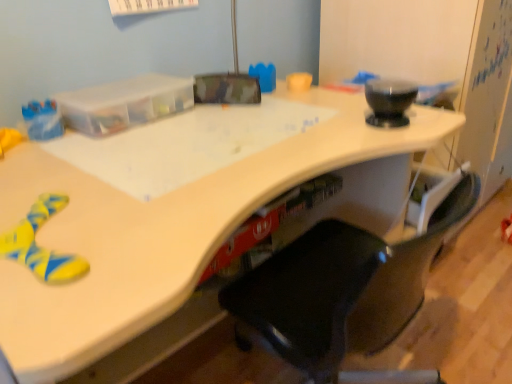
Question: Considering the relative positions of white glossy desk at lower left and rubberized red toy at lower right in the image provided, is white glossy desk at lower left to the right of rubberized red toy at lower right from the viewer's perspective?

Choices:
 (A) yes
 (B) no

Answer: (B)

Question: Considering the relative sizes of white glossy desk at lower left and rubberized red toy at lower right in the image provided, is white glossy desk at lower left smaller than rubberized red toy at lower right?

Choices:
 (A) yes
 (B) no

Answer: (B)

Question: Can you confirm if white glossy desk at lower left is positioned to the left of rubberized red toy at lower right?

Choices:
 (A) yes
 (B) no

Answer: (A)

Question: From a real-world perspective, is white glossy desk at lower left over rubberized red toy at lower right?

Choices:
 (A) no
 (B) yes

Answer: (A)

Question: Is white glossy desk at lower left positioned far away from rubberized red toy at lower right?

Choices:
 (A) no
 (B) yes

Answer: (B)

Question: Is white glossy desk at lower left oriented away from rubberized red toy at lower right?

Choices:
 (A) yes
 (B) no

Answer: (B)

Question: Is black plastic chair at center placed right next to white glossy desk at lower left?

Choices:
 (A) yes
 (B) no

Answer: (B)

Question: Does black plastic chair at center turn towards white glossy desk at lower left?

Choices:
 (A) yes
 (B) no

Answer: (B)

Question: Can you confirm if black plastic chair at center is taller than white glossy desk at lower left?

Choices:
 (A) no
 (B) yes

Answer: (B)

Question: Considering the relative positions of black plastic chair at center and white glossy desk at lower left in the image provided, is black plastic chair at center to the right of white glossy desk at lower left from the viewer's perspective?

Choices:
 (A) yes
 (B) no

Answer: (B)

Question: Is black plastic chair at center completely or partially outside of white glossy desk at lower left?

Choices:
 (A) no
 (B) yes

Answer: (B)

Question: Is white glossy desk at lower left surrounded by black plastic chair at center?

Choices:
 (A) no
 (B) yes

Answer: (A)

Question: Is the position of black plastic chair at center more distant than that of rubberized red toy at lower right?

Choices:
 (A) no
 (B) yes

Answer: (A)